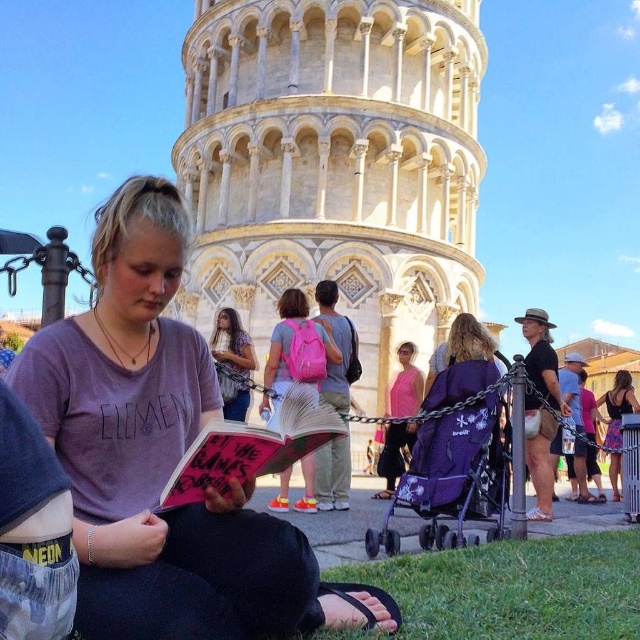
Question: Does white stone tower at center come behind denim jacket at center?

Choices:
 (A) no
 (B) yes

Answer: (B)

Question: Which is nearer to the white stone tower at center?

Choices:
 (A) green grass at lower center
 (B) purple fabric stroller at center
 (C) pink fabric backpack at center

Answer: (C)

Question: Is denim jacket at center positioned behind floral dress at center?

Choices:
 (A) yes
 (B) no

Answer: (B)

Question: Does white stone tower at center appear on the left side of pink fabric backpack at center?

Choices:
 (A) yes
 (B) no

Answer: (B)

Question: Estimate the real-world distances between objects in this image. Which object is closer to the denim jacket at center?

Choices:
 (A) pink fabric dress at center
 (B) purple fabric stroller at center
 (C) white stone tower at center

Answer: (A)

Question: Which object is the farthest from the purple fabric stroller at center?

Choices:
 (A) floral dress at center
 (B) pink matte book at center
 (C) denim jacket at center

Answer: (B)